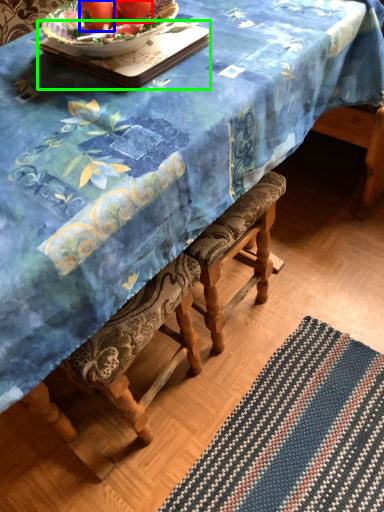
Question: Considering the real-world distances, which object is closest to tomato (highlighted by a red box)? tomato (highlighted by a blue box) or tray (highlighted by a green box).

Choices:
 (A) tomato
 (B) tray

Answer: (A)